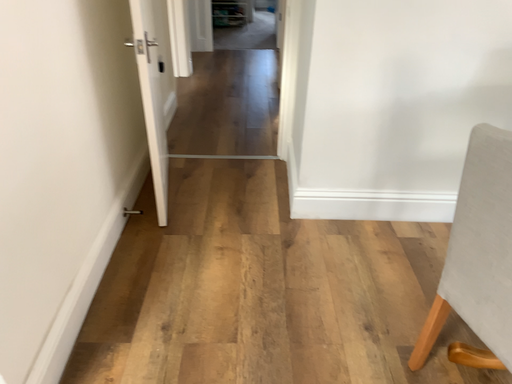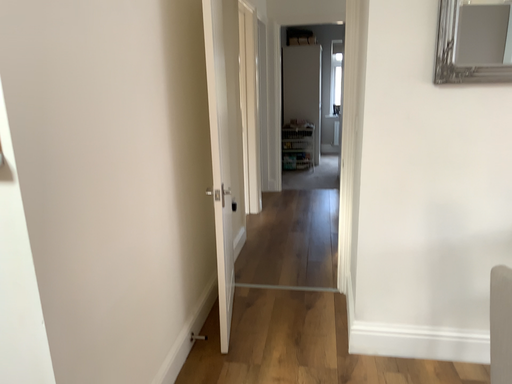
Question: How did the camera likely rotate when shooting the video?

Choices:
 (A) rotated left
 (B) rotated right

Answer: (A)